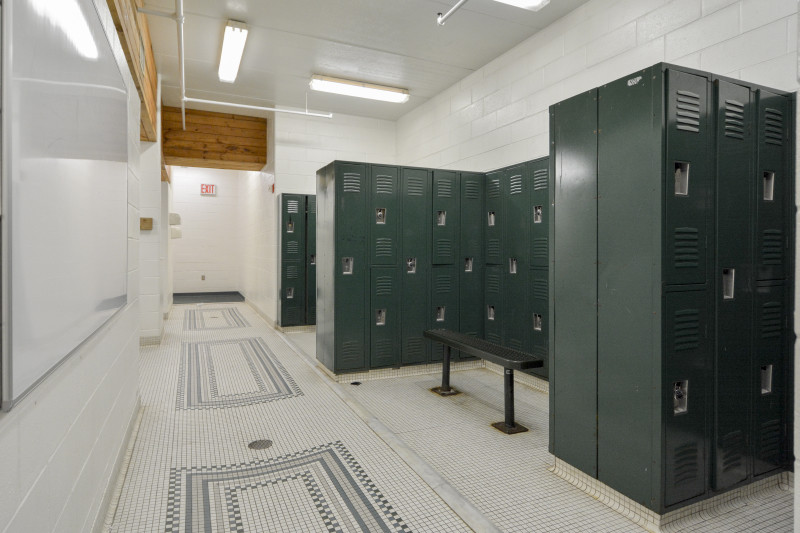
The image size is (800, 533). I want to click on locker room, so pos(238,248).